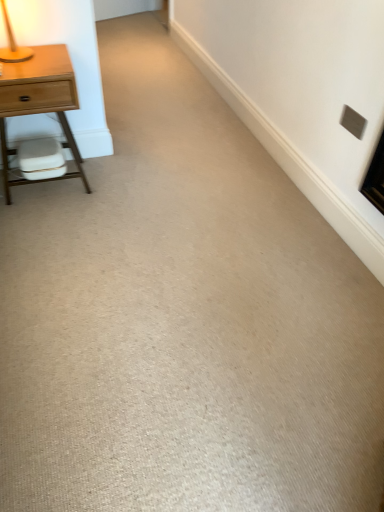
Question: From the image's perspective, would you say light wood/finish nightstand at left is shown under white matte swivel chair at left?

Choices:
 (A) no
 (B) yes

Answer: (A)

Question: Is light wood/finish nightstand at left taller than white matte swivel chair at left?

Choices:
 (A) no
 (B) yes

Answer: (B)

Question: Is light wood/finish nightstand at left wider than white matte swivel chair at left?

Choices:
 (A) no
 (B) yes

Answer: (B)

Question: From a real-world perspective, is light wood/finish nightstand at left under white matte swivel chair at left?

Choices:
 (A) yes
 (B) no

Answer: (B)

Question: Can you confirm if light wood/finish nightstand at left is shorter than white matte swivel chair at left?

Choices:
 (A) no
 (B) yes

Answer: (A)

Question: From the image's perspective, is light wood/finish nightstand at left on white matte swivel chair at left?

Choices:
 (A) yes
 (B) no

Answer: (A)

Question: Can you confirm if gray matte electric outlet at upper right is smaller than wooden table lamp at upper left?

Choices:
 (A) yes
 (B) no

Answer: (A)

Question: Can you confirm if gray matte electric outlet at upper right is bigger than wooden table lamp at upper left?

Choices:
 (A) no
 (B) yes

Answer: (A)

Question: Is gray matte electric outlet at upper right placed right next to wooden table lamp at upper left?

Choices:
 (A) no
 (B) yes

Answer: (A)

Question: Is gray matte electric outlet at upper right oriented away from wooden table lamp at upper left?

Choices:
 (A) yes
 (B) no

Answer: (B)

Question: Is gray matte electric outlet at upper right not inside wooden table lamp at upper left?

Choices:
 (A) yes
 (B) no

Answer: (A)

Question: From the image's perspective, is gray matte electric outlet at upper right under wooden table lamp at upper left?

Choices:
 (A) yes
 (B) no

Answer: (A)

Question: From a real-world perspective, is gray matte electric outlet at upper right under white matte swivel chair at left?

Choices:
 (A) yes
 (B) no

Answer: (B)